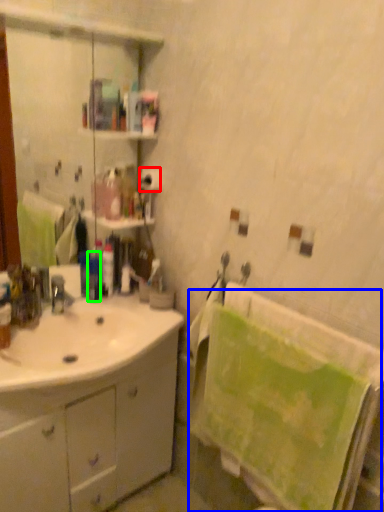
Question: Which is nearer to the toilet paper (highlighted by a red box)? bath towel (highlighted by a blue box) or toiletry (highlighted by a green box).

Choices:
 (A) bath towel
 (B) toiletry

Answer: (B)